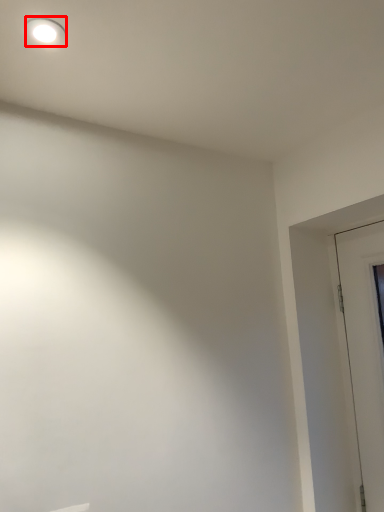
Question: From the image's perspective, where is lighting (annotated by the red box) located relative to door?

Choices:
 (A) below
 (B) above

Answer: (B)